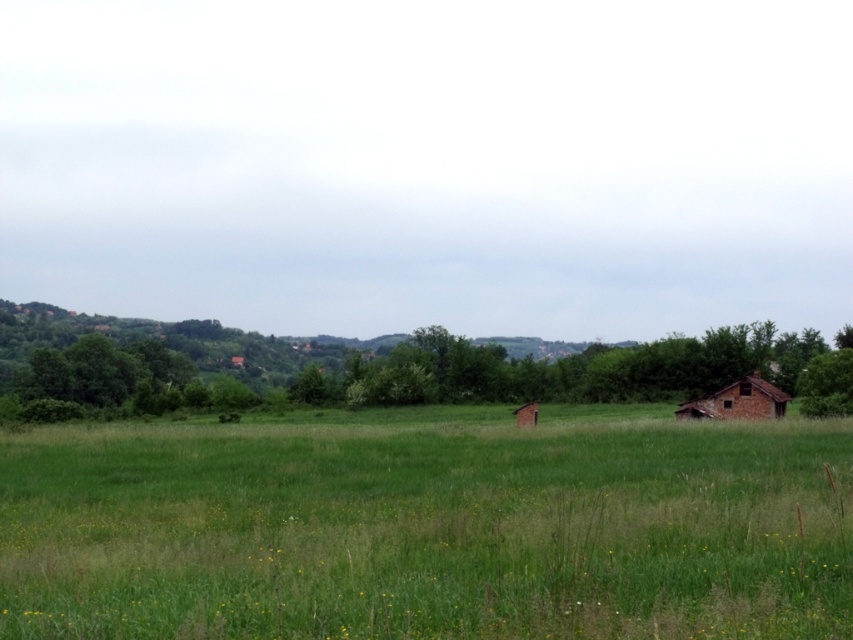
Describe the element at coordinates (405, 368) in the screenshot. The height and width of the screenshot is (640, 853). I see `green leafy tree at center` at that location.

Is green leafy tree at center positioned behind brown rustic hut at lower right?

Yes, it is behind brown rustic hut at lower right.

Is point (537, 380) more distant than point (693, 404)?

Yes, point (537, 380) is farther from viewer.

At what (x,y) coordinates should I click in order to perform the action: click on green leafy tree at center. Please return your answer as a coordinate pair (x, y). The width and height of the screenshot is (853, 640). Looking at the image, I should click on (405, 368).

Can you confirm if green grassy pasture at center is bigger than brown rustic hut at lower right?

Indeed, green grassy pasture at center has a larger size compared to brown rustic hut at lower right.

Between point (132, 461) and point (750, 394), which one is positioned behind?

Point (750, 394)

At what (x,y) coordinates should I click in order to perform the action: click on green grassy pasture at center. Please return your answer as a coordinate pair (x, y). Looking at the image, I should click on (428, 529).

This screenshot has height=640, width=853. Describe the element at coordinates (428, 529) in the screenshot. I see `green grassy pasture at center` at that location.

Which is in front, point (202, 470) or point (820, 353)?

Point (202, 470) is more forward.

Image resolution: width=853 pixels, height=640 pixels. I want to click on green grassy pasture at center, so click(x=428, y=529).